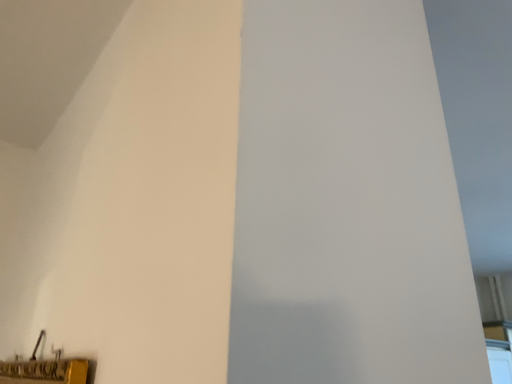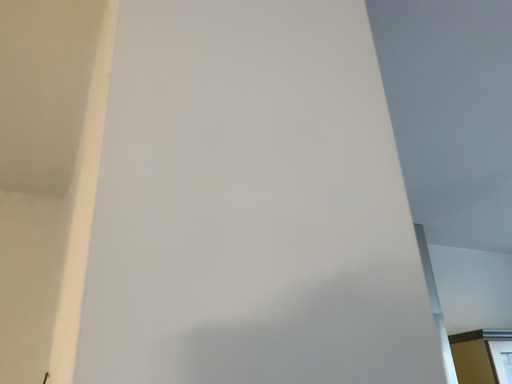
Question: Which way did the camera rotate in the video?

Choices:
 (A) rotated right
 (B) rotated left

Answer: (B)